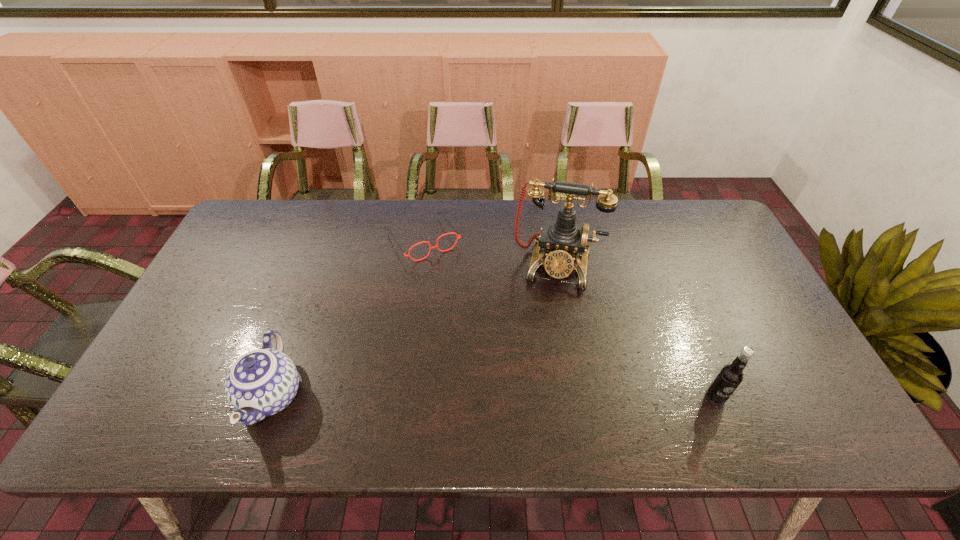
Find the location of a particular element. The height and width of the screenshot is (540, 960). free location located 0.270m on the front-facing side of the shortest object is located at coordinates (481, 323).

I want to click on free space located 0.270m on the front of the telephone, featuring the rotary dial, so click(x=538, y=373).

You are a GUI agent. You are given a task and a screenshot of the screen. Output one action in this format:
    pyautogui.click(x=<x>, y=<y>)
    Task: Click on the vacant space situated 0.300m on the front of the telephone, featuring the rotary dial
    
    Given the screenshot: What is the action you would take?
    pyautogui.click(x=536, y=383)

Image resolution: width=960 pixels, height=540 pixels. What are the coordinates of `free region located on the front of the telephone, featuring the rotary dial` in the screenshot? It's located at (548, 306).

What are the coordinates of `spectacles that is at the far edge` in the screenshot? It's located at (436, 246).

The image size is (960, 540). Find the location of `telephone located in the far edge section of the desktop`. telephone located in the far edge section of the desktop is located at coordinates (562, 240).

Locate an element on the screen. chinaware that is at the near edge is located at coordinates (262, 382).

Find the location of `root beer that is positioned at the near edge`. root beer that is positioned at the near edge is located at coordinates (730, 376).

Locate an element on the screen. The height and width of the screenshot is (540, 960). vacant area at the far edge is located at coordinates (323, 239).

The image size is (960, 540). Find the location of `vacant space at the near edge of the desktop`. vacant space at the near edge of the desktop is located at coordinates (335, 369).